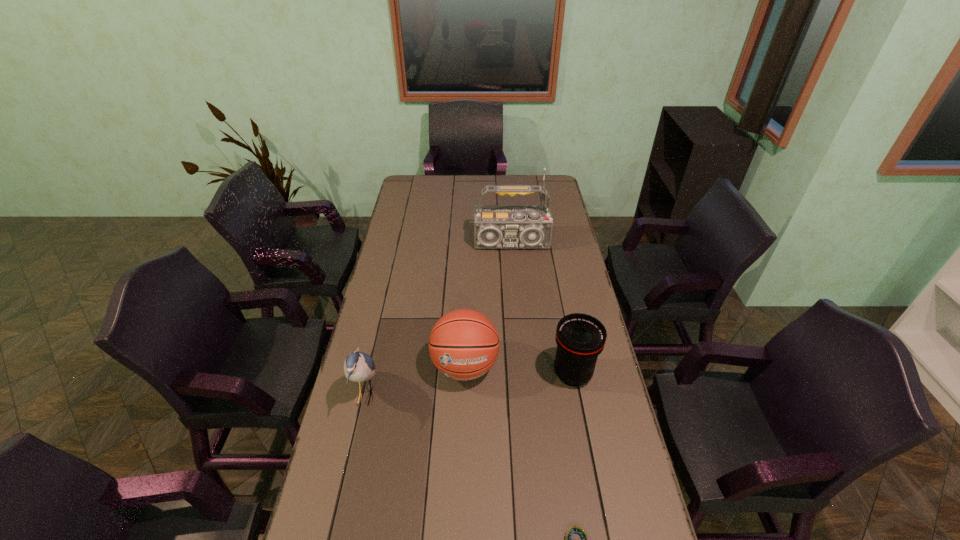
Image resolution: width=960 pixels, height=540 pixels. What are the coordinates of `free space that satisfies the following two spatial constraints: 1. on the front-facing side of the farthest object; 2. at the tip of the leftmost object's beak` in the screenshot? It's located at (525, 395).

Identify the location of vacant space that satisfies the following two spatial constraints: 1. on the front-facing side of the radio receiver; 2. at the tip of the leftmost object's beak. This screenshot has height=540, width=960. [x=525, y=395].